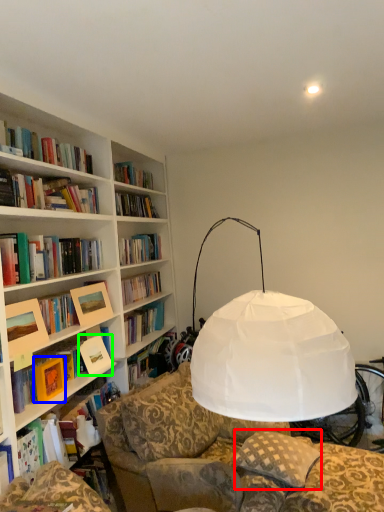
Question: Which object is the closest to the pillow (highlighted by a red box)? Choose among these: paperback book (highlighted by a blue box) or paperback book (highlighted by a green box).

Choices:
 (A) paperback book
 (B) paperback book

Answer: (B)